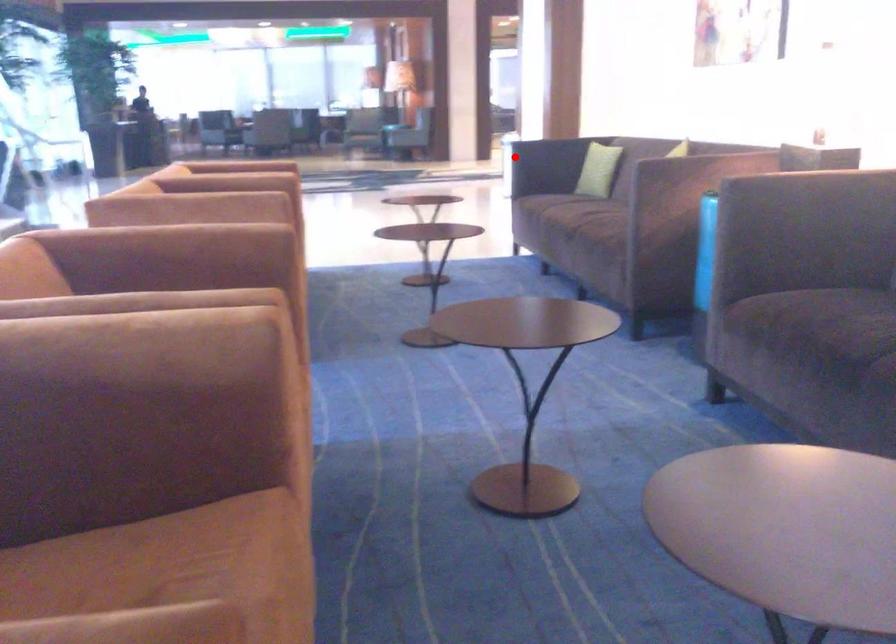
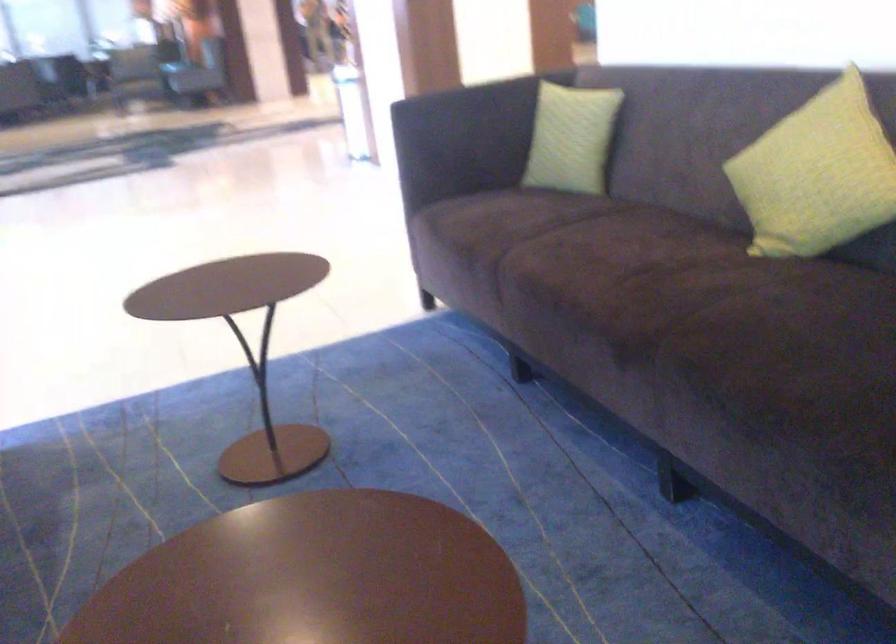
Question: A red point is marked in image1. In image2, is the corresponding 3D point closer to the camera or farther? Reply with the corresponding letter.

Choices:
 (A) The corresponding 3D point is closer.
 (B) The corresponding 3D point is farther.

Answer: (A)